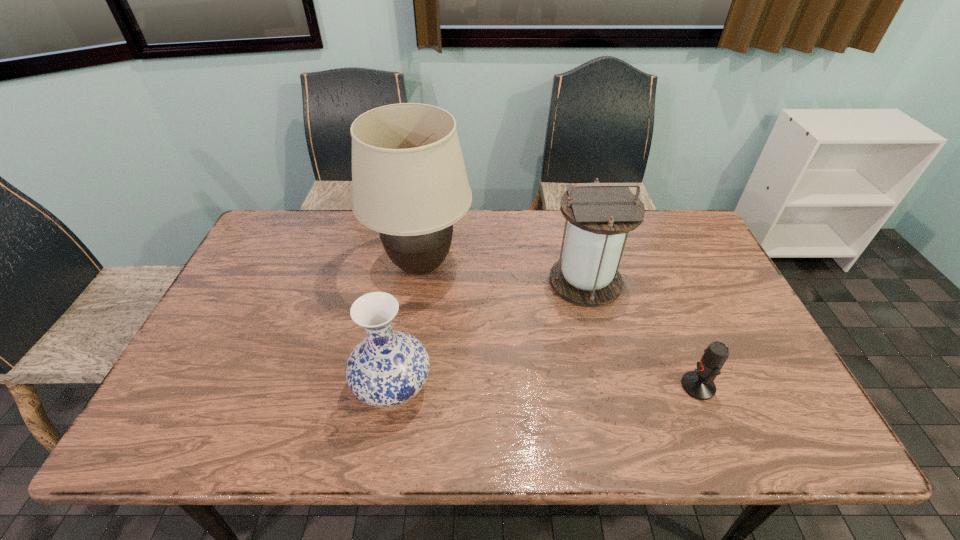
Where is `vacant space located 0.140m on the side of the shortest object with the red ring`? The height and width of the screenshot is (540, 960). vacant space located 0.140m on the side of the shortest object with the red ring is located at coordinates (623, 386).

Find the location of a particular element. The width and height of the screenshot is (960, 540). vacant space located on the side of the shortest object with the red ring is located at coordinates (586, 386).

Where is `object situated at the far edge`? This screenshot has height=540, width=960. object situated at the far edge is located at coordinates (409, 181).

This screenshot has height=540, width=960. Identify the location of object located at the near edge. (387, 368).

Image resolution: width=960 pixels, height=540 pixels. Find the location of `vacant space at the far edge of the desktop`. vacant space at the far edge of the desktop is located at coordinates (365, 248).

This screenshot has width=960, height=540. I want to click on vacant region at the near edge of the desktop, so click(421, 412).

Where is `vacant region at the left edge of the desktop`? Image resolution: width=960 pixels, height=540 pixels. vacant region at the left edge of the desktop is located at coordinates (237, 286).

Locate an element on the screen. free space at the right edge is located at coordinates (708, 329).

The width and height of the screenshot is (960, 540). In the image, there is a desktop. What are the coordinates of `free space at the far left corner` in the screenshot? It's located at (281, 241).

Where is `free space that is in between the second object from right to left and the vase`? free space that is in between the second object from right to left and the vase is located at coordinates (490, 334).